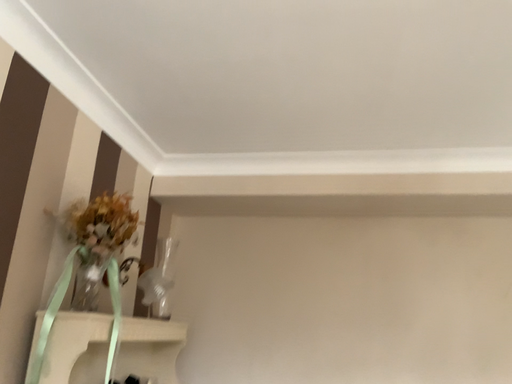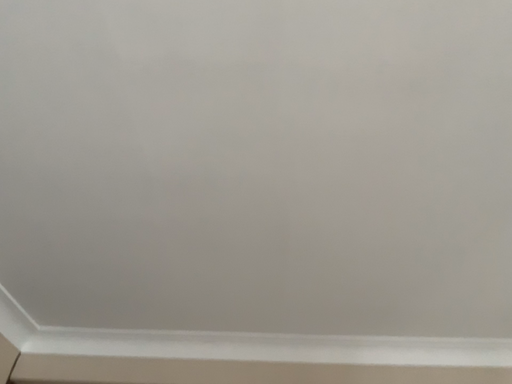
Question: Which way did the camera rotate in the video?

Choices:
 (A) rotated upward
 (B) rotated downward

Answer: (A)